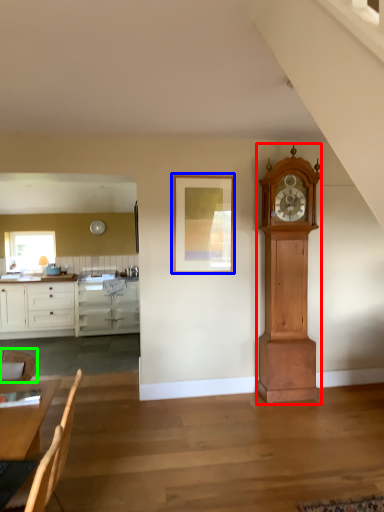
Question: Which object is positioned farthest from wall clock (highlighted by a red box)? Select from picture frame (highlighted by a blue box) and chair (highlighted by a green box).

Choices:
 (A) picture frame
 (B) chair

Answer: (B)